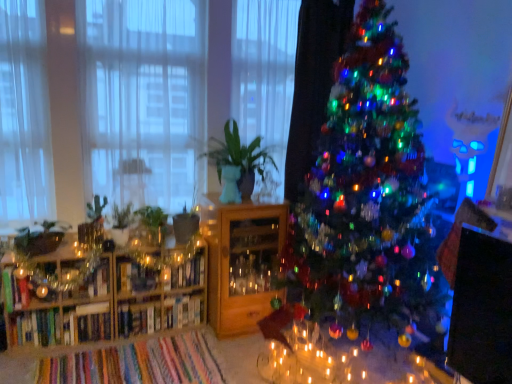
Question: Is metallic glass shelf at left, which is the 1th shelf in left-to-right order, not inside green matte plant at left, which is the 1th plant from left to right?

Choices:
 (A) yes
 (B) no

Answer: (A)

Question: Is metallic glass shelf at left, which is the 1th shelf in left-to-right order, thinner than green matte plant at left, which is the 1th plant from left to right?

Choices:
 (A) no
 (B) yes

Answer: (B)

Question: Would you say metallic glass shelf at left, which is the 1th shelf in left-to-right order, contains green matte plant at left, which is the 1th plant from left to right?

Choices:
 (A) yes
 (B) no

Answer: (B)

Question: From the image's perspective, is metallic glass shelf at left, which is the 1th shelf in left-to-right order, located beneath green matte plant at left, which is counted as the 2th plant, starting from the right?

Choices:
 (A) no
 (B) yes

Answer: (B)

Question: Is metallic glass shelf at left, which is the 1th shelf in left-to-right order, looking in the opposite direction of green matte plant at left, which is counted as the 2th plant, starting from the right?

Choices:
 (A) yes
 (B) no

Answer: (B)

Question: Could white sheer curtain at left, placed as the third curtain when sorted from right to left, be considered to be inside wooden cabinet at center, which ranks as the second shelf in left-to-right order?

Choices:
 (A) yes
 (B) no

Answer: (B)

Question: Is wooden cabinet at center, which ranks as the second shelf in left-to-right order, positioned with its back to white sheer curtain at left, placed as the third curtain when sorted from right to left?

Choices:
 (A) yes
 (B) no

Answer: (B)

Question: Is wooden cabinet at center, the 1th shelf viewed from the right, oriented towards white sheer curtain at left, positioned as the 1th curtain in left-to-right order?

Choices:
 (A) no
 (B) yes

Answer: (A)

Question: Considering the relative sizes of wooden cabinet at center, which ranks as the second shelf in left-to-right order, and white sheer curtain at left, placed as the third curtain when sorted from right to left, in the image provided, is wooden cabinet at center, which ranks as the second shelf in left-to-right order, thinner than white sheer curtain at left, placed as the third curtain when sorted from right to left,?

Choices:
 (A) yes
 (B) no

Answer: (B)

Question: Is there a large distance between wooden cabinet at center, the 1th shelf viewed from the right, and white sheer curtain at left, placed as the third curtain when sorted from right to left?

Choices:
 (A) no
 (B) yes

Answer: (B)

Question: Is wooden cabinet at center, the 1th shelf viewed from the right, taller than white sheer curtain at left, placed as the third curtain when sorted from right to left?

Choices:
 (A) yes
 (B) no

Answer: (B)

Question: Considering the relative positions of white sheer curtain at left, the 2th curtain from the right, and green matte plant at left, the second plant from the left, in the image provided, is white sheer curtain at left, the 2th curtain from the right, to the right of green matte plant at left, the second plant from the left, from the viewer's perspective?

Choices:
 (A) no
 (B) yes

Answer: (B)